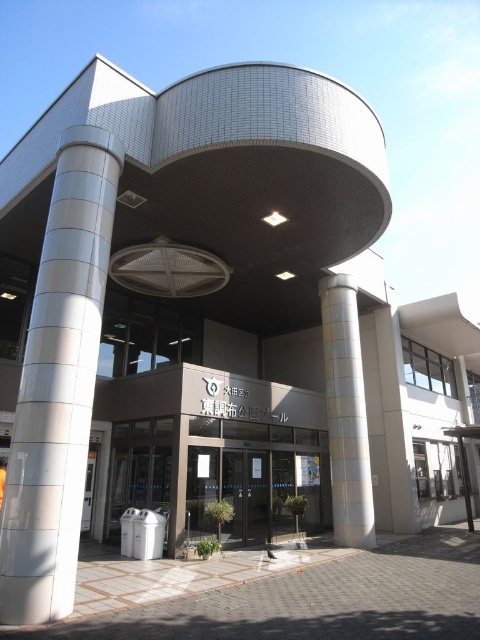
Who is more forward, (60, 148) or (335, 280)?

Point (60, 148)

Can you confirm if white glossy column at left is taller than white textured pillar at center?

No.

Is point (73, 509) closer to camera compared to point (352, 513)?

Yes.

Identify the location of white glossy column at left. (59, 384).